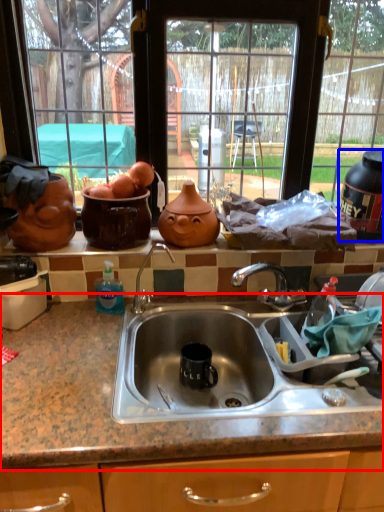
Question: Among these objects, which one is nearest to the camera, countertop (highlighted by a red box) or appliance (highlighted by a blue box)?

Choices:
 (A) countertop
 (B) appliance

Answer: (A)